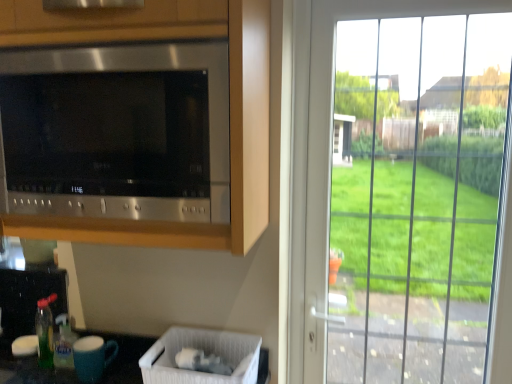
Question: Do you think white plastic laundry basket at lower center is within green translucent bottle at lower left, or outside of it?

Choices:
 (A) inside
 (B) outside

Answer: (B)

Question: Based on their positions, is white plastic laundry basket at lower center located to the left or right of green translucent bottle at lower left?

Choices:
 (A) right
 (B) left

Answer: (A)

Question: Estimate the real-world distances between objects in this image. Which object is farther from the white plastic laundry basket at lower center?

Choices:
 (A) clear glass door at right
 (B) green translucent bottle at lower left
 (C) stainless steel microwave at upper left
 (D) blue matte mug at lower left

Answer: (C)

Question: Considering the real-world distances, which object is closest to the clear glass door at right?

Choices:
 (A) stainless steel microwave at upper left
 (B) green translucent bottle at lower left
 (C) white plastic laundry basket at lower center
 (D) blue matte mug at lower left

Answer: (A)